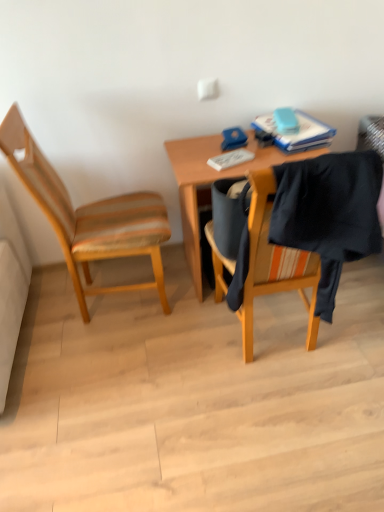
At what (x,y) coordinates should I click in order to perform the action: click on empty space that is ontop of wooden desk at center (from a real-world perspective). Please return your answer as a coordinate pair (x, y). The width and height of the screenshot is (384, 512). Looking at the image, I should click on (232, 149).